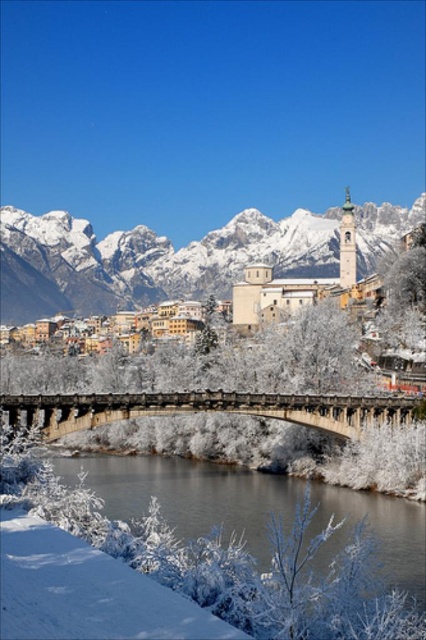
You are a photographer planning to capture the reflection of the church in the white frosted water at lower center. Since the concrete bridge at center might block your view, can you confirm if the water is higher or lower than the bridge to determine the best shooting angle?

The white frosted water at lower center has a greater height compared to the concrete bridge at center, so the water is higher. This means you can position yourself lower to capture the reflection without the bridge obstructing the view.

You are standing at the base of the snowy granite mountains at upper center and want to take a photo of them using a camera that has a maximum focus range of 1000 feet. Will the camera be able to focus on the mountains?

The snowy granite mountains at upper center and camera are 1153.54 feet apart from each other. Since the camera can only focus up to 1000 feet, it will not be able to focus on the mountains.

You are standing at the center of the stone bridge and want to locate the white frosted water at lower center. According to the coordinates provided, in which direction should you look to see it?

The white frosted water at lower center is located at coordinates point (235, 550), so you should look towards the lower right direction from the center of the stone bridge to see it.